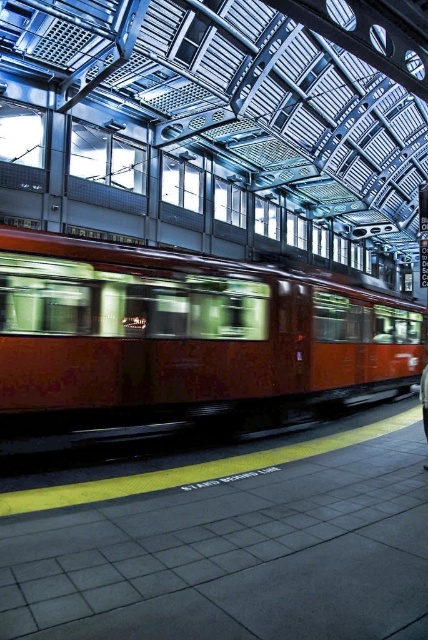
Does matte orange train at center appear on the right side of dark blue jeans at center?

Incorrect, matte orange train at center is not on the right side of dark blue jeans at center.

Can you confirm if matte orange train at center is thinner than dark blue jeans at center?

Incorrect, matte orange train at center's width is not less than dark blue jeans at center's.

Does point (12, 305) come farther from viewer compared to point (425, 390)?

No, (12, 305) is closer to viewer.

At what (x,y) coordinates should I click in order to perform the action: click on matte orange train at center. Please return your answer as a coordinate pair (x, y). Image resolution: width=428 pixels, height=640 pixels. Looking at the image, I should click on (186, 337).